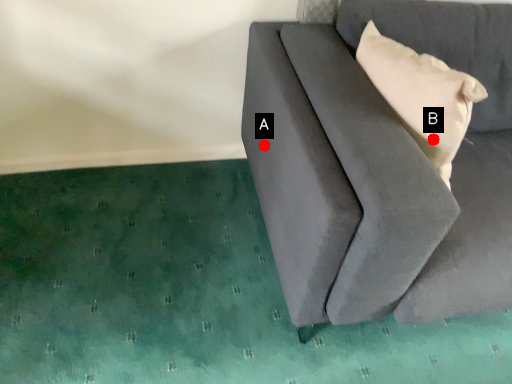
Question: Two points are circled on the image, labeled by A and B beside each circle. Which point is farther from the camera taking this photo?

Choices:
 (A) A is further
 (B) B is further

Answer: (A)